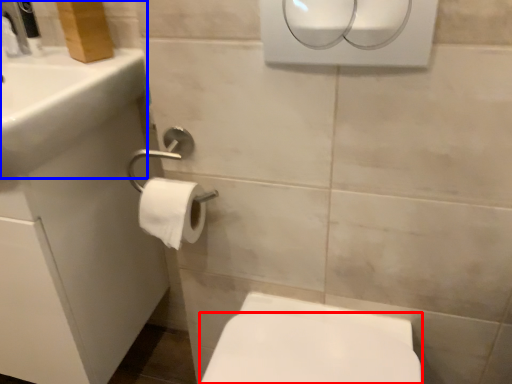
Question: Which object is closer to the camera taking this photo, bidet (highlighted by a red box) or sink (highlighted by a blue box)?

Choices:
 (A) bidet
 (B) sink

Answer: (B)